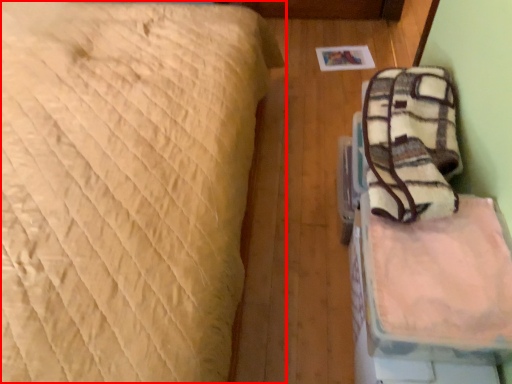
Question: From the image's perspective, where is bed (annotated by the red box) located relative to sheet?

Choices:
 (A) below
 (B) above

Answer: (B)